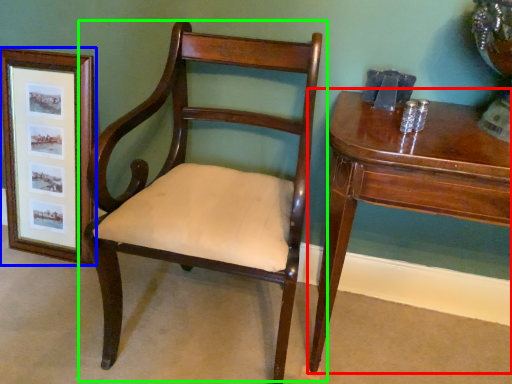
Question: Which object is the closest to the table (highlighted by a red box)? Choose among these: picture frame (highlighted by a blue box) or chair (highlighted by a green box).

Choices:
 (A) picture frame
 (B) chair

Answer: (B)